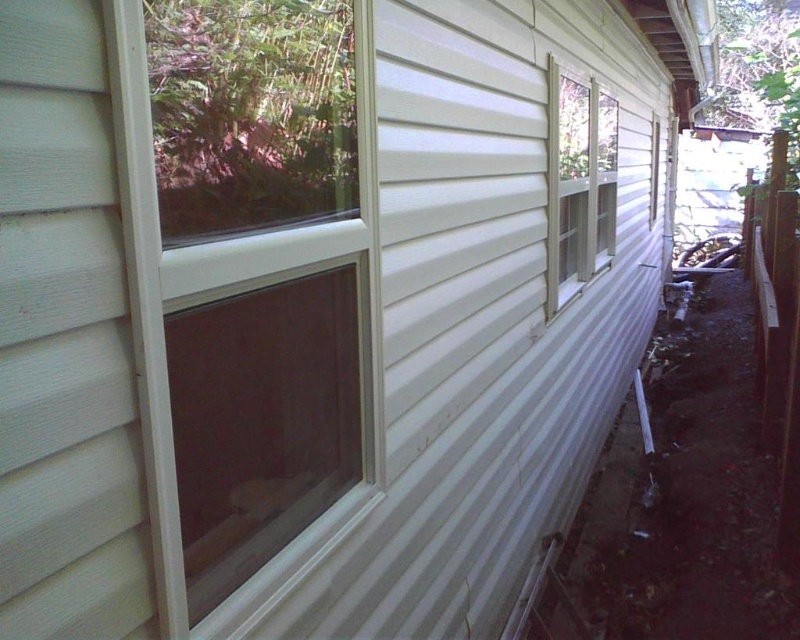
Does clear glass window at center have a greater height compared to clear glass window at upper right?

No, clear glass window at center is not taller than clear glass window at upper right.

Does point (333, 497) come farther from viewer compared to point (580, 248)?

No.

Where is `clear glass window at center`? The image size is (800, 640). clear glass window at center is located at coordinates (248, 273).